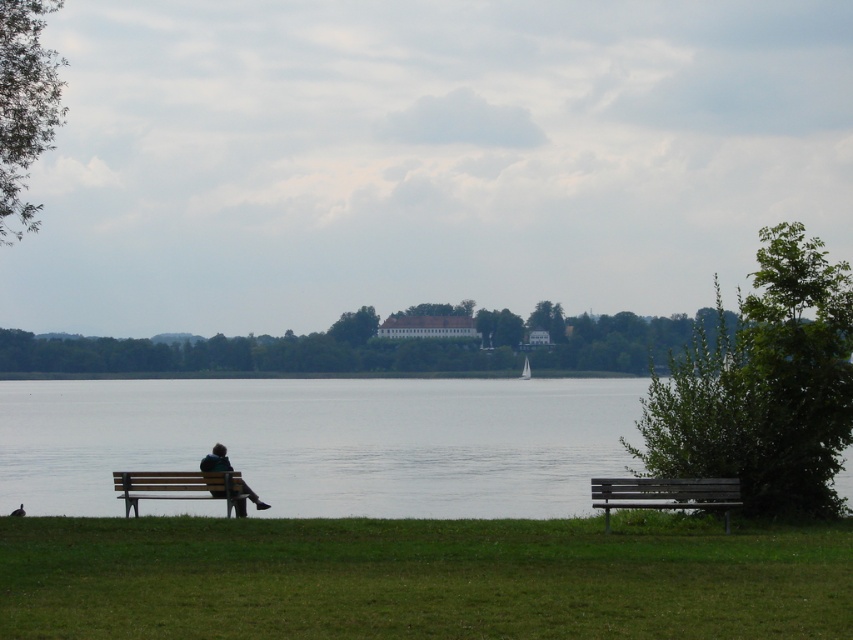
Who is more distant from viewer, (190, 474) or (223, 449)?

The point (223, 449) is more distant.

What are the coordinates of `wooden bench at lower left` in the screenshot? It's located at (181, 486).

Is transparent water at lower center further to the viewer compared to wooden bench at lower left?

No, it is in front of wooden bench at lower left.

Consider the image. Is transparent water at lower center above wooden bench at lower left?

No, transparent water at lower center is not above wooden bench at lower left.

Does point (485, 429) come in front of point (223, 472)?

No, (485, 429) is further to viewer.

Find the location of `transparent water at lower center`. transparent water at lower center is located at coordinates click(x=323, y=442).

How much distance is there between transparent water at lower center and blue denim jacket at lower left?

transparent water at lower center is 27.44 meters from blue denim jacket at lower left.

Based on the photo, who is lower down, transparent water at lower center or blue denim jacket at lower left?

transparent water at lower center

Locate an element on the screen. This screenshot has width=853, height=640. transparent water at lower center is located at coordinates (323, 442).